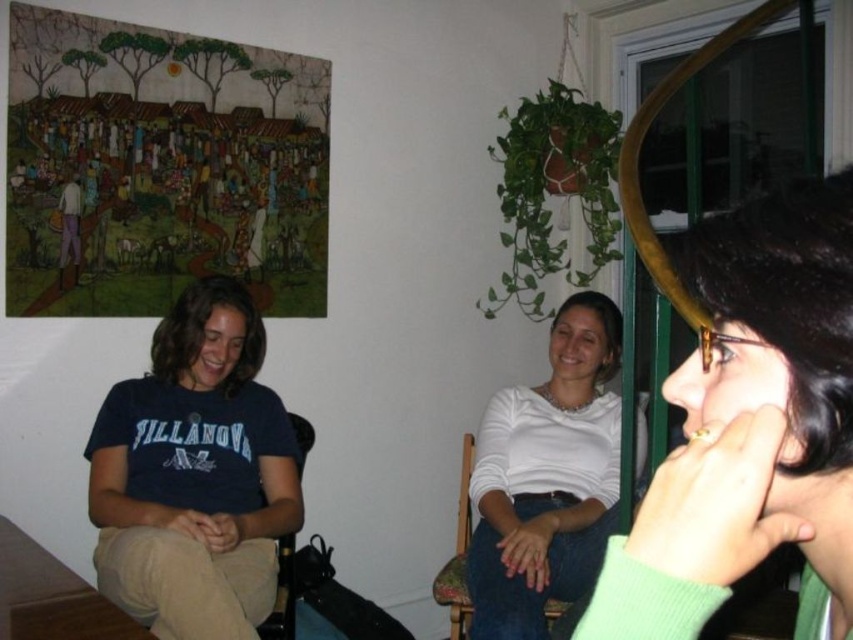
Who is shorter, green matte sweater at right or white matte shirt at center?

With less height is green matte sweater at right.

Between green matte sweater at right and white matte shirt at center, which one is positioned lower?

white matte shirt at center is below.

From the picture: Who is more forward, (x=817, y=234) or (x=541, y=480)?

Point (x=817, y=234) is in front.

You are a GUI agent. You are given a task and a screenshot of the screen. Output one action in this format:
    pyautogui.click(x=<x>, y=<y>)
    Task: Click on the green matte sweater at right
    The width and height of the screenshot is (853, 640).
    Given the screenshot: What is the action you would take?
    pyautogui.click(x=751, y=428)

Is blue cotton shirt at left closer to the viewer compared to brown leather chair at lower left?

Yes, blue cotton shirt at left is in front of brown leather chair at lower left.

Does blue cotton shirt at left have a greater width compared to brown leather chair at lower left?

Indeed, blue cotton shirt at left has a greater width compared to brown leather chair at lower left.

Between point (234, 300) and point (288, 596), which one is positioned in front?

Point (234, 300) is in front.

Identify the location of blue cotton shirt at left. This screenshot has height=640, width=853. (194, 474).

Is green matte sweater at right closer to camera compared to brown leather chair at lower left?

Yes, it is in front of brown leather chair at lower left.

What do you see at coordinates (751, 428) in the screenshot? The height and width of the screenshot is (640, 853). I see `green matte sweater at right` at bounding box center [751, 428].

Identify the location of green matte sweater at right. (751, 428).